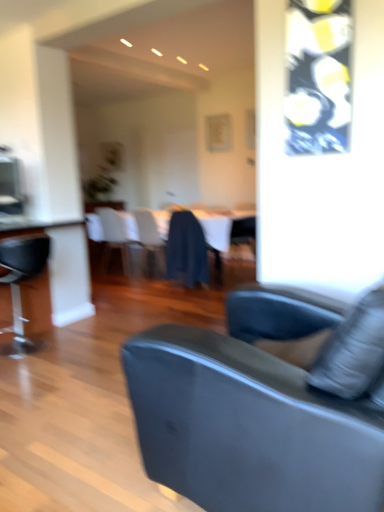
You are a GUI agent. You are given a task and a screenshot of the screen. Output one action in this format:
    pyautogui.click(x=<x>, y=<y>)
    Task: Click on the white fabric chair at center, the 5th chair in the front-to-back sequence
    The image size is (384, 512).
    Given the screenshot: What is the action you would take?
    pyautogui.click(x=115, y=239)

Looking at this image, measure the distance between point (187, 250) and camera.

Point (187, 250) and camera are 4.63 meters apart.

This screenshot has width=384, height=512. What do you see at coordinates (227, 231) in the screenshot?
I see `white glossy table at center` at bounding box center [227, 231].

In order to face translucent plastic chair at center, the 3th chair positioned from the back, should I rotate leftwards or rightwards?

You should look left and rotate roughly 4.487 degrees.

Find the location of a particular element. Image resolution: width=384 pixels, height=512 pixels. matte blue chair at center, acting as the 4th chair starting from the front is located at coordinates (243, 230).

Image resolution: width=384 pixels, height=512 pixels. I want to click on white fabric chair at center, the 5th chair in the front-to-back sequence, so click(115, 239).

Where is `chair that is the 3rd one when counting forward from the white fabric chair at center, the 5th chair in the front-to-back sequence`? The width and height of the screenshot is (384, 512). chair that is the 3rd one when counting forward from the white fabric chair at center, the 5th chair in the front-to-back sequence is located at coordinates (186, 250).

From the image's perspective, would you say dark blue fabric at center, the fourth chair when ordered from back to front, is positioned over white fabric chair at center, the first chair in the back-to-front sequence?

Incorrect, from the image's perspective, dark blue fabric at center, the fourth chair when ordered from back to front, is lower than white fabric chair at center, the first chair in the back-to-front sequence.

Can you confirm if dark blue fabric at center, the 2th chair from the front, is positioned to the right of white fabric chair at center, the 5th chair in the front-to-back sequence?

Indeed, dark blue fabric at center, the 2th chair from the front, is positioned on the right side of white fabric chair at center, the 5th chair in the front-to-back sequence.

Is dark blue fabric at center, the 2th chair from the front, inside or outside of white fabric chair at center, the 5th chair in the front-to-back sequence?

dark blue fabric at center, the 2th chair from the front, exists outside the volume of white fabric chair at center, the 5th chair in the front-to-back sequence.

Based on the photo, from their relative heights in the image, would you say translucent plastic chair at center, which appears as the 3th chair when viewed from the front, is taller or shorter than dark blue fabric at center, the 2th chair from the front?

Clearly, translucent plastic chair at center, which appears as the 3th chair when viewed from the front, is taller compared to dark blue fabric at center, the 2th chair from the front.

In order to click on the 1st chair below the translucent plastic chair at center, the 3th chair positioned from the back (from the image's perspective) in this screenshot , I will do `click(186, 250)`.

Can you confirm if translucent plastic chair at center, the 3th chair positioned from the back, is positioned to the right of dark blue fabric at center, the 2th chair from the front?

No, translucent plastic chair at center, the 3th chair positioned from the back, is not to the right of dark blue fabric at center, the 2th chair from the front.

Who is bigger, translucent plastic chair at center, the 3th chair positioned from the back, or dark blue fabric at center, the fourth chair when ordered from back to front?

translucent plastic chair at center, the 3th chair positioned from the back.

Which is more to the left, black leather chair at left, which appears as the first chair when viewed from the front, or matte blue chair at center, the 2th chair from the back?

From the viewer's perspective, black leather chair at left, which appears as the first chair when viewed from the front, appears more on the left side.

From a real-world perspective, which is physically above, black leather chair at left, acting as the fifth chair starting from the back, or matte blue chair at center, acting as the 4th chair starting from the front?

From a 3D spatial view, matte blue chair at center, acting as the 4th chair starting from the front, is above.

Is point (39, 248) closer to camera compared to point (219, 284)?

Yes, it is in front of point (219, 284).

Which of these two, white fabric chair at center, the first chair in the back-to-front sequence, or dark blue fabric at center, the fourth chair when ordered from back to front, stands taller?

white fabric chair at center, the first chair in the back-to-front sequence, is taller.

In the scene shown: Is dark blue fabric at center, the fourth chair when ordered from back to front, a part of white fabric chair at center, the first chair in the back-to-front sequence?

No, dark blue fabric at center, the fourth chair when ordered from back to front, is located outside of white fabric chair at center, the first chair in the back-to-front sequence.

Who is smaller, white fabric chair at center, the first chair in the back-to-front sequence, or dark blue fabric at center, the 2th chair from the front?

With smaller size is dark blue fabric at center, the 2th chair from the front.

Locate an element on the screen. This screenshot has height=512, width=384. chair that is the 3rd object located in front of the white fabric chair at center, the 5th chair in the front-to-back sequence is located at coordinates (186, 250).

Is the surface of dark blue fabric at center, the fourth chair when ordered from back to front, in direct contact with suede-like gray couch at center?

No, dark blue fabric at center, the fourth chair when ordered from back to front, is not touching suede-like gray couch at center.

Is point (176, 249) closer to camera compared to point (243, 382)?

No, it is behind (243, 382).

Could you tell me if dark blue fabric at center, the 2th chair from the front, is facing suede-like gray couch at center?

No, dark blue fabric at center, the 2th chair from the front, is not facing towards suede-like gray couch at center.

Is matte blue chair at center, acting as the 4th chair starting from the front, bigger or smaller than translucent plastic chair at center, the 3th chair positioned from the back?

Clearly, matte blue chair at center, acting as the 4th chair starting from the front, is smaller in size than translucent plastic chair at center, the 3th chair positioned from the back.

From the image's perspective, is matte blue chair at center, the 2th chair from the back, beneath translucent plastic chair at center, which appears as the 3th chair when viewed from the front?

No.

Which of these two, matte blue chair at center, acting as the 4th chair starting from the front, or translucent plastic chair at center, which appears as the 3th chair when viewed from the front, is thinner?

translucent plastic chair at center, which appears as the 3th chair when viewed from the front.

Is the depth of matte blue chair at center, the 2th chair from the back, greater than that of translucent plastic chair at center, which appears as the 3th chair when viewed from the front?

Yes, matte blue chair at center, the 2th chair from the back, is behind translucent plastic chair at center, which appears as the 3th chair when viewed from the front.

Does suede-like gray couch at center appear on the left side of white fabric chair at center, the 5th chair in the front-to-back sequence?

No.

From the image's perspective, is suede-like gray couch at center located beneath white fabric chair at center, the first chair in the back-to-front sequence?

Indeed, from the image's perspective, suede-like gray couch at center is shown beneath white fabric chair at center, the first chair in the back-to-front sequence.

Could you tell me if suede-like gray couch at center is turned towards white fabric chair at center, the first chair in the back-to-front sequence?

No, suede-like gray couch at center is not oriented towards white fabric chair at center, the first chair in the back-to-front sequence.

Which is nearer, (x=220, y=464) or (x=106, y=208)?

Point (x=220, y=464) is closer to the camera than point (x=106, y=208).

Starting from the white fabric chair at center, the 5th chair in the front-to-back sequence, which chair is the 3rd one in front? Please provide its 2D coordinates.

[(186, 250)]

At what (x,y) coordinates should I click in order to perform the action: click on the 1st chair to the left of the dark blue fabric at center, the fourth chair when ordered from back to front, counting from the anchor's position. Please return your answer as a coordinate pair (x, y). Looking at the image, I should click on pos(149,241).

When comparing their distances from dark blue fabric at center, the 2th chair from the front, does white glossy table at center or translucent plastic chair at center, the 3th chair positioned from the back, seem closer?

Based on the image, translucent plastic chair at center, the 3th chair positioned from the back, appears to be nearer to dark blue fabric at center, the 2th chair from the front.

Looking at the image, which one is located closer to matte blue chair at center, the 2th chair from the back, white fabric chair at center, the first chair in the back-to-front sequence, or suede-like gray couch at center?

Among the two, white fabric chair at center, the first chair in the back-to-front sequence, is located nearer to matte blue chair at center, the 2th chair from the back.

Estimate the real-world distances between objects in this image. Which object is further from dark blue fabric at center, the 2th chair from the front, matte blue chair at center, the 2th chair from the back, or white fabric chair at center, the first chair in the back-to-front sequence?

matte blue chair at center, the 2th chair from the back, is further to dark blue fabric at center, the 2th chair from the front.

Which object lies further to the anchor point white glossy table at center, dark blue fabric at center, the 2th chair from the front, or suede-like gray couch at center?

suede-like gray couch at center lies further to white glossy table at center than the other object.

Estimate the real-world distances between objects in this image. Which object is closer to black leather chair at left, acting as the fifth chair starting from the back, white glossy table at center or translucent plastic chair at center, the 3th chair positioned from the back?

translucent plastic chair at center, the 3th chair positioned from the back, is closer to black leather chair at left, acting as the fifth chair starting from the back.

Looking at the image, which one is located further to suede-like gray couch at center, matte blue chair at center, acting as the 4th chair starting from the front, or translucent plastic chair at center, which appears as the 3th chair when viewed from the front?

Among the two, matte blue chair at center, acting as the 4th chair starting from the front, is located further to suede-like gray couch at center.

Consider the image. Estimate the real-world distances between objects in this image. Which object is further from matte blue chair at center, the 2th chair from the back, suede-like gray couch at center or white glossy table at center?

suede-like gray couch at center.

Looking at the image, which one is located closer to white glossy table at center, suede-like gray couch at center or translucent plastic chair at center, the 3th chair positioned from the back?

translucent plastic chair at center, the 3th chair positioned from the back, is positioned closer to the anchor white glossy table at center.

Identify the location of table between white fabric chair at center, the first chair in the back-to-front sequence, and matte blue chair at center, acting as the 4th chair starting from the front. Image resolution: width=384 pixels, height=512 pixels. (227, 231).

Locate an element on the screen. This screenshot has width=384, height=512. chair situated between translucent plastic chair at center, the 3th chair positioned from the back, and matte blue chair at center, acting as the 4th chair starting from the front, from left to right is located at coordinates click(186, 250).

Locate an element on the screen. The height and width of the screenshot is (512, 384). table between black leather chair at left, acting as the fifth chair starting from the back, and matte blue chair at center, the 2th chair from the back, along the z-axis is located at coordinates pos(227,231).

Locate an element on the screen. The width and height of the screenshot is (384, 512). table between suede-like gray couch at center and matte blue chair at center, acting as the 4th chair starting from the front, along the z-axis is located at coordinates (227, 231).